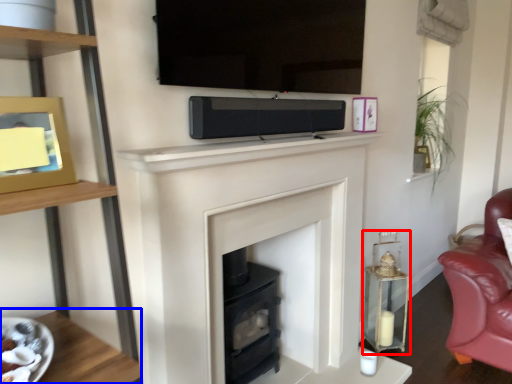
Question: Which point is further to the camera, candle holder (highlighted by a red box) or table (highlighted by a blue box)?

Choices:
 (A) candle holder
 (B) table

Answer: (A)